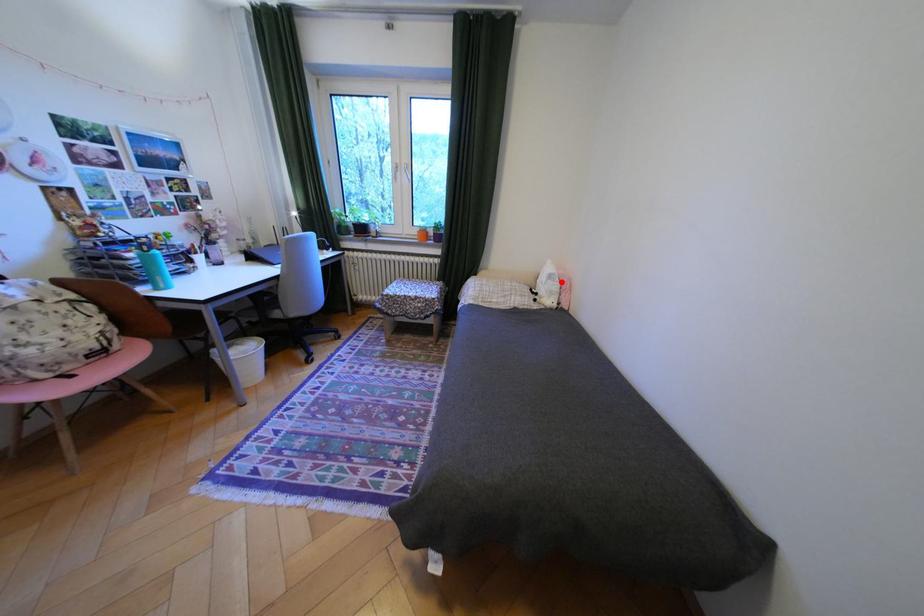
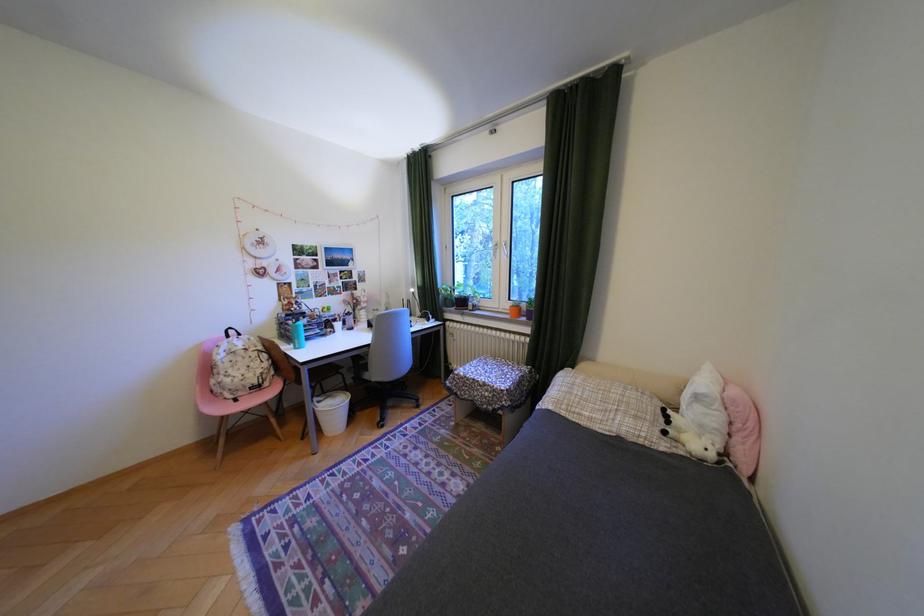
Where in the second image is the point corresponding to the highlighted location from the first image?

(710, 408)